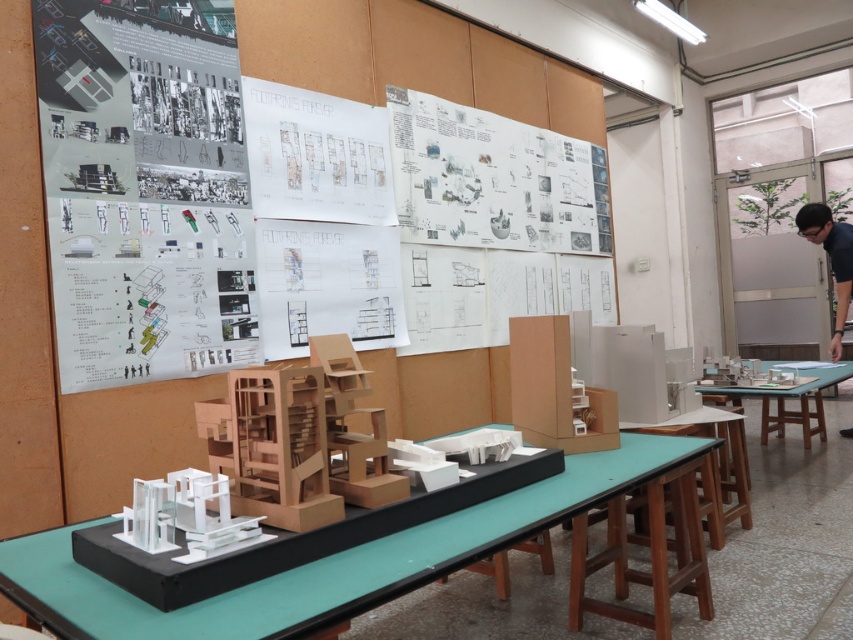
Is the position of white paper at upper center less distant than that of black shirt at right?

Yes, it is.

This screenshot has width=853, height=640. What do you see at coordinates (173, 188) in the screenshot?
I see `white paper at upper center` at bounding box center [173, 188].

The image size is (853, 640). I want to click on white paper at upper center, so click(173, 188).

Does white glossy model at center appear on the right side of green matte table at center?

Incorrect, white glossy model at center is not on the right side of green matte table at center.

Is the position of white glossy model at center less distant than that of green matte table at center?

Yes.

Find the location of a particular element. The width and height of the screenshot is (853, 640). white glossy model at center is located at coordinates (328, 560).

You are a GUI agent. You are given a task and a screenshot of the screen. Output one action in this format:
    pyautogui.click(x=<x>, y=<y>)
    Task: Click on the white glossy model at center
    
    Given the screenshot: What is the action you would take?
    pyautogui.click(x=328, y=560)

Does point (514, 516) lie behind point (836, 225)?

No, it is not.

Who is more distant from viewer, (x=360, y=586) or (x=843, y=435)?

The point (x=843, y=435) is more distant.

The width and height of the screenshot is (853, 640). I want to click on white glossy model at center, so click(x=328, y=560).